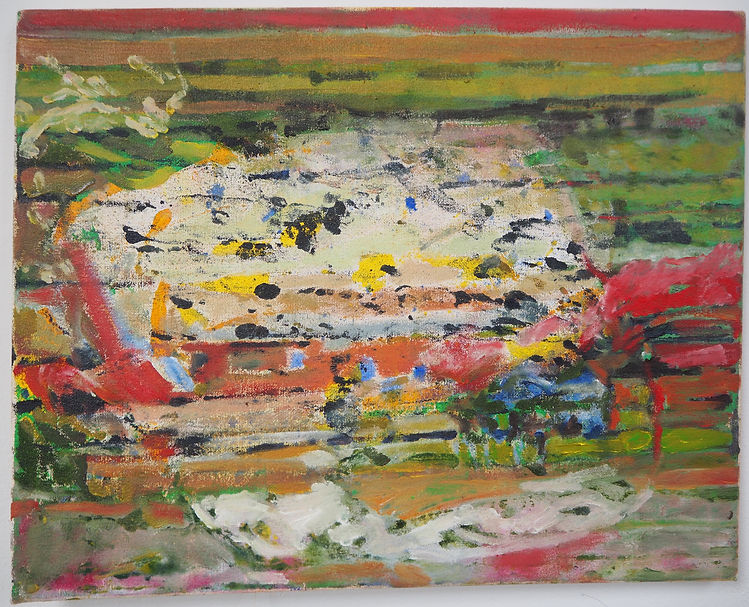
The image size is (749, 607). I want to click on green ish paint splatter, so click(x=73, y=538), click(x=130, y=143), click(x=539, y=161), click(x=648, y=201), click(x=700, y=238), click(x=714, y=443).